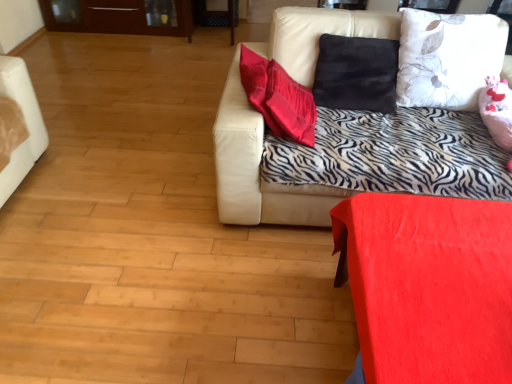
Question: From the image's perspective, is leather couch at upper right positioned above or below white floral fabric pillow at upper right?

Choices:
 (A) below
 (B) above

Answer: (A)

Question: In terms of size, does leather couch at upper right appear bigger or smaller than white floral fabric pillow at upper right?

Choices:
 (A) small
 (B) big

Answer: (B)

Question: Which is nearer to the white floral fabric pillow at upper right?

Choices:
 (A) matte red table at lower right
 (B) leather couch at upper right

Answer: (B)

Question: Estimate the real-world distances between objects in this image. Which object is closer to the white floral fabric pillow at upper right?

Choices:
 (A) leather couch at upper right
 (B) matte red table at lower right

Answer: (A)